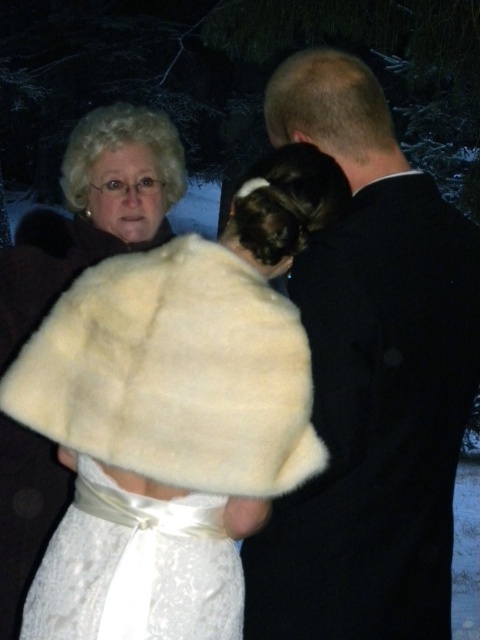
Consider the image. You are a photographer at this event and want to ensure both the black satin suit at center and the white satin dress at center are fully visible in your photo. Given their current positions, which one might be partially obscured and why?

The white satin dress at center is partially obscured because the black satin suit at center is positioned over it.

Consider the image. In the nighttime snowy scene, there is a white fur shawl at upper left and a white satin dress at center. Which object is positioned higher relative to the other?

The white fur shawl at upper left is located above the white satin dress at center.